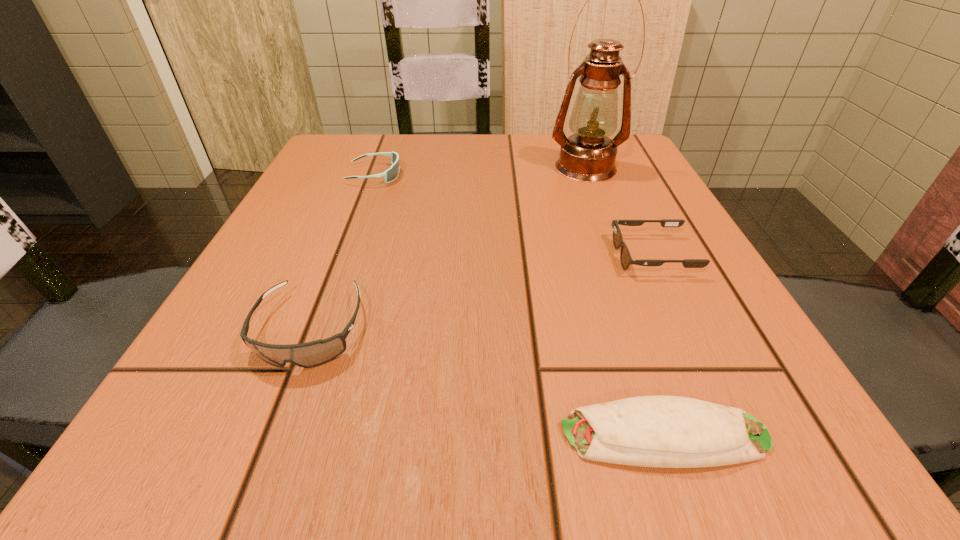
In order to click on burrito present at the right edge in this screenshot , I will do `click(650, 431)`.

Find the location of a particular element. object located at the far left corner is located at coordinates (391, 174).

Where is `object that is at the far right corner`? object that is at the far right corner is located at coordinates (588, 155).

This screenshot has width=960, height=540. Identify the location of object that is at the near right corner. (650, 431).

In the image, there is a desktop. Where is `vacant space at the far edge`? vacant space at the far edge is located at coordinates (468, 138).

Where is `vacant space at the near edge`? This screenshot has height=540, width=960. vacant space at the near edge is located at coordinates (392, 429).

The image size is (960, 540). In order to click on free space at the left edge of the desktop in this screenshot , I will do `click(279, 344)`.

In the image, there is a desktop. Where is `free region at the right edge`? This screenshot has width=960, height=540. free region at the right edge is located at coordinates (658, 297).

In the image, there is a desktop. Where is `free space at the far left corner`? The image size is (960, 540). free space at the far left corner is located at coordinates (366, 181).

Locate an element on the screen. vacant space at the far right corner of the desktop is located at coordinates (617, 168).